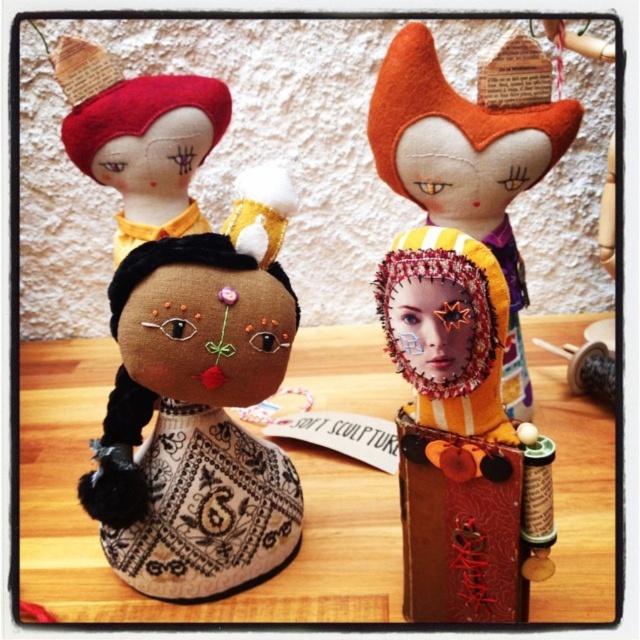
Question: Which object is the farthest from the brown fabric doll at center?

Choices:
 (A) textured fabric doll at center
 (B) wooden table at center
 (C) orange felt doll at center

Answer: (C)

Question: From the image, what is the correct spatial relationship of wooden table at center in relation to textured fabric doll at center?

Choices:
 (A) below
 (B) above

Answer: (B)

Question: Which point is farther to the camera?

Choices:
 (A) (163, 515)
 (B) (512, 243)

Answer: (B)

Question: Which is nearer to the orange felt doll at center?

Choices:
 (A) textured fabric doll at center
 (B) brown fabric doll at center
 (C) wooden table at center

Answer: (B)

Question: Does wooden table at center have a larger size compared to brown fabric doll at center?

Choices:
 (A) yes
 (B) no

Answer: (A)

Question: In this image, where is brown fabric doll at center located relative to textured fabric doll at center?

Choices:
 (A) left
 (B) right

Answer: (A)